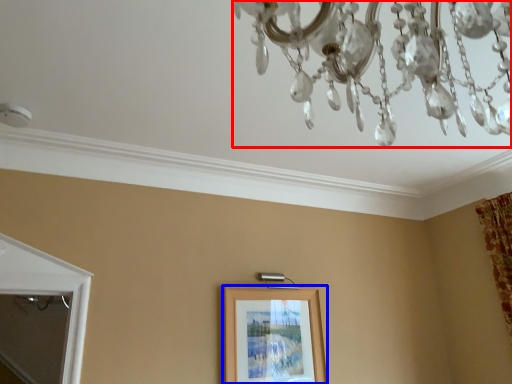
Question: Which of the following is the closest to the observer, chandelier (highlighted by a red box) or picture frame (highlighted by a blue box)?

Choices:
 (A) chandelier
 (B) picture frame

Answer: (A)